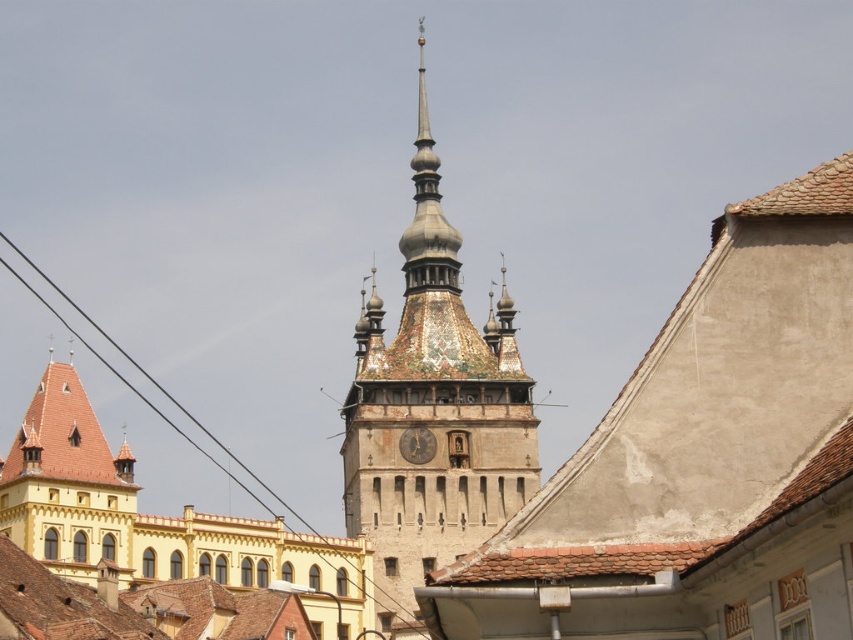
Based on the scene description, where is the multicolored mosaic clock tower at center located in the image?

The multicolored mosaic clock tower at center is located at point (433, 408) in the image.

You are an architect visiting the historic town and want to compare the dimensions of the buildings. Given that the gold textured clock at center is a key landmark, how does the width of the yellow brick building at left compare to it?

The yellow brick building at left is wider than the gold textured clock at center, as stated in the description that the yellow brick building at left has a larger width than the gold textured clock at center.

You are an architect examining the historic town layout. You need to determine the spatial relationship between the multicolored mosaic clock tower at center and the gold textured clock at center. Which object is positioned closer to the observer?

The multicolored mosaic clock tower at center is closer to the observer than the gold textured clock at center.